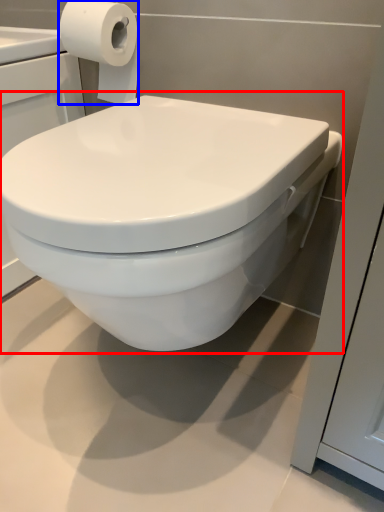
Question: Which object appears closest to the camera in this image, toilet (highlighted by a red box) or toilet paper (highlighted by a blue box)?

Choices:
 (A) toilet
 (B) toilet paper

Answer: (A)